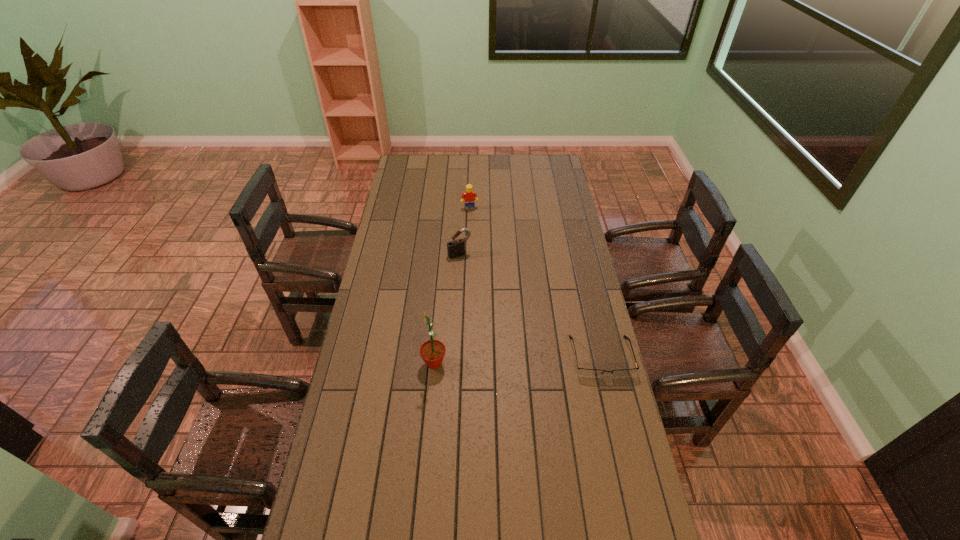
The image size is (960, 540). In order to click on free point between the tallest object and the padlock in this screenshot , I will do `click(446, 309)`.

Where is `empty location between the padlock and the spectacles`? The height and width of the screenshot is (540, 960). empty location between the padlock and the spectacles is located at coordinates (530, 306).

Find the location of `vacant space that is in between the sunflower and the third nearest object`. vacant space that is in between the sunflower and the third nearest object is located at coordinates (446, 309).

You are a GUI agent. You are given a task and a screenshot of the screen. Output one action in this format:
    pyautogui.click(x=<x>, y=<y>)
    Task: Click on the vacant area that lies between the rightmost object and the sunflower
    The width and height of the screenshot is (960, 540).
    Given the screenshot: What is the action you would take?
    pyautogui.click(x=517, y=360)

The width and height of the screenshot is (960, 540). Find the location of `free point between the tallest object and the rightmost object`. free point between the tallest object and the rightmost object is located at coordinates (517, 360).

Where is `free space between the farthest object and the tallest object`? This screenshot has height=540, width=960. free space between the farthest object and the tallest object is located at coordinates (452, 286).

Where is `unoccupied area between the sunflower and the shortest object`? The width and height of the screenshot is (960, 540). unoccupied area between the sunflower and the shortest object is located at coordinates (517, 360).

Identify which object is located as the second nearest to the farthest object. Please provide its 2D coordinates. Your answer should be formatted as a tuple, i.e. [(x, y)], where the tuple contains the x and y coordinates of a point satisfying the conditions above.

[(590, 373)]

Identify which object is the third nearest to the second farthest object. Please provide its 2D coordinates. Your answer should be formatted as a tuple, i.e. [(x, y)], where the tuple contains the x and y coordinates of a point satisfying the conditions above.

[(590, 373)]

Identify the location of vacant space that satisfies the following two spatial constraints: 1. on the back side of the second farthest object; 2. on the left side of the Lego. [462, 208].